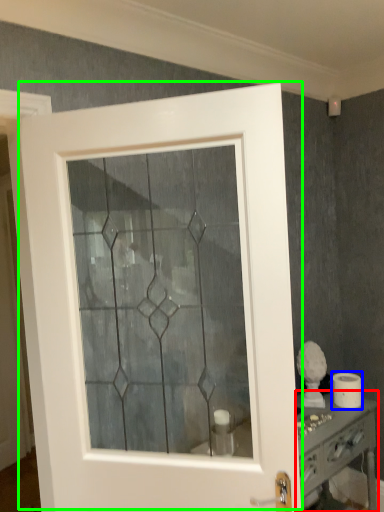
Question: Which object is the farthest from vanity (highlighted by a red box)? Choose among these: toilet paper (highlighted by a blue box) or door (highlighted by a green box).

Choices:
 (A) toilet paper
 (B) door

Answer: (B)